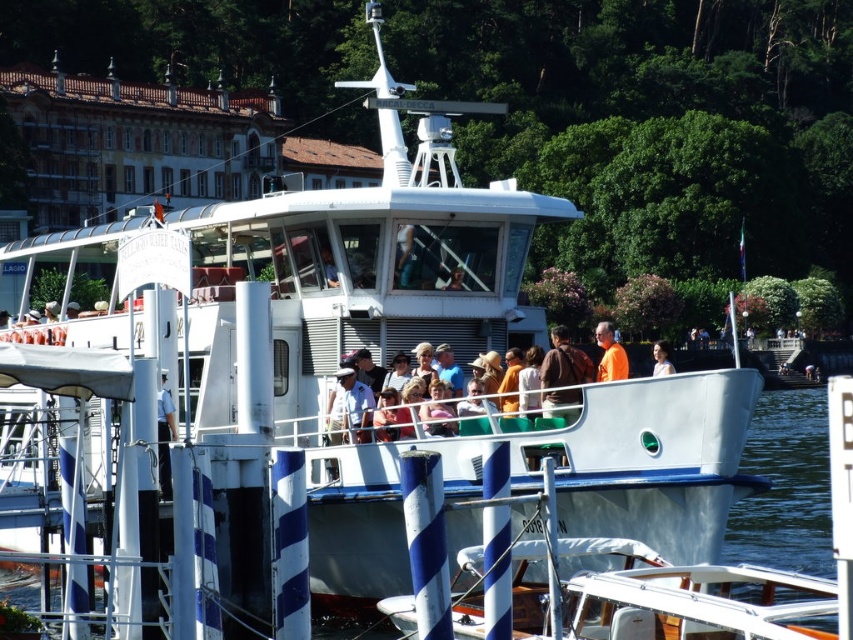
You are a photographer on the tourist boat and want to capture both the brown leather jacket at center and the orange fabric shirt at center in a single photo. Based on their positions, which one should you focus on first to ensure both are in frame?

The brown leather jacket at center is below the orange fabric shirt at center, so you should focus on the orange fabric shirt at center first to ensure both are in frame.

You are a photographer on the tourist boat and want to take a photo of both the orange fabric shirt at center and the matte orange shirt at center. Which one should you pan your camera to the right to capture first?

The orange fabric shirt at center is to the left of matte orange shirt at center, so you should pan your camera to the right to first capture the orange fabric shirt at center before the matte orange shirt at center.